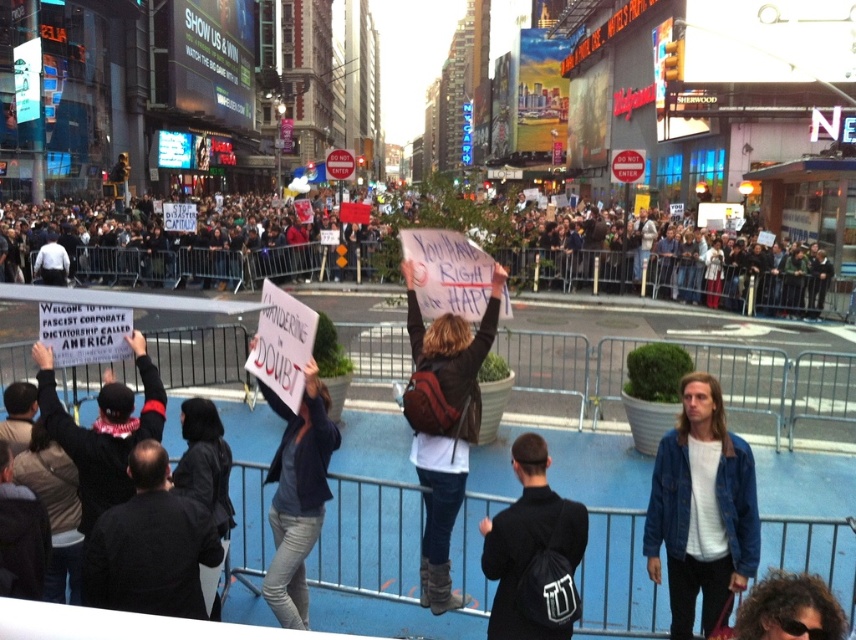
Question: Is black scarf at left thinner than curly hair at lower right?

Choices:
 (A) no
 (B) yes

Answer: (A)

Question: Which is nearer to the black fabric backpack at center?

Choices:
 (A) curly hair at lower right
 (B) dark blue jacket at center
 (C) brown leather backpack at center
 (D) denim jacket at lower right

Answer: (D)

Question: Which point is farther to the camera?

Choices:
 (A) dark gray jacket at lower left
 (B) denim jacket at lower right

Answer: (B)

Question: Can you confirm if dark gray jacket at lower left is wider than curly hair at lower right?

Choices:
 (A) no
 (B) yes

Answer: (B)

Question: Which object is the closest to the dark gray concrete crowd at upper center?

Choices:
 (A) dark blue jacket at center
 (B) curly hair at lower right
 (C) brown leather backpack at center
 (D) black scarf at left

Answer: (A)

Question: Can you confirm if dark gray concrete crowd at upper center is positioned to the right of curly hair at lower right?

Choices:
 (A) no
 (B) yes

Answer: (A)